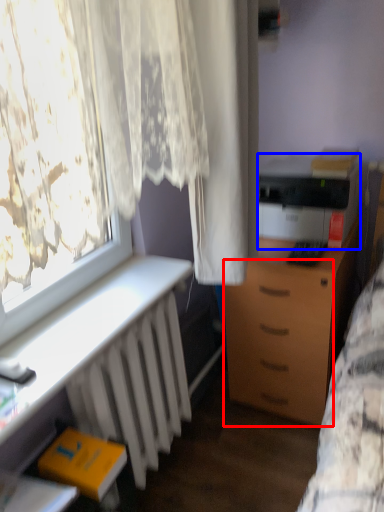
Question: Which point is further to the camera, drawer (highlighted by a red box) or printer (highlighted by a blue box)?

Choices:
 (A) drawer
 (B) printer

Answer: (B)